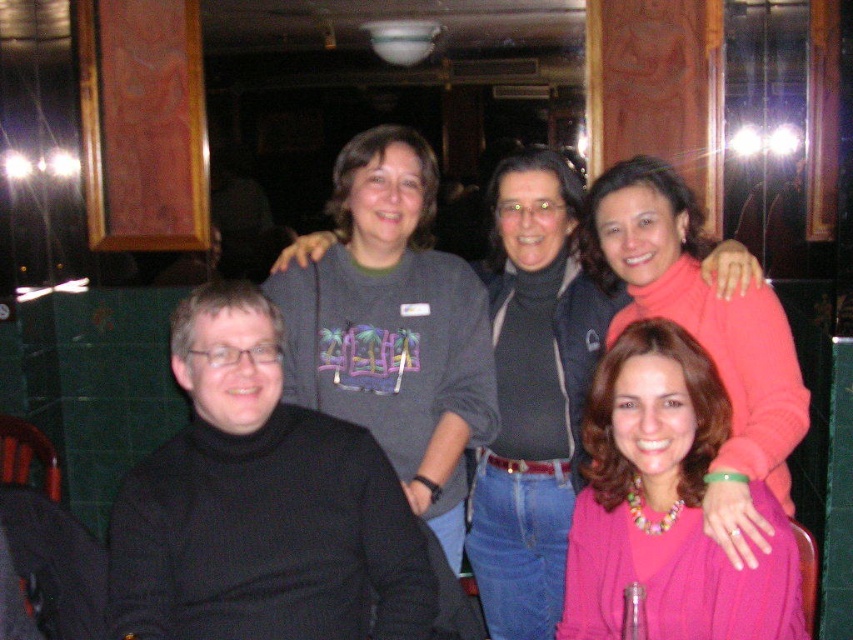
You are taking a photo of the group and want to focus on the person at point (373, 525) and the person at point (688, 202). Which of these two points is closer to the camera?

Point (373, 525) is closer to the camera than point (688, 202).

You are standing in front of the group of five people in the image. You want to place a small gift on the table between the two points labeled point (125,483) and point (642,499). Which point should you place the gift closer to so that it is nearer to the viewer?

You should place the gift closer to point (125,483) because it is nearer to the viewer than point (642,499).

You are standing in the same room as the group in the image. If you want to approach the person wearing the black turtleneck sweater at left, which direction should you move relative to your current position?

The black turtleneck sweater at left is located at point 0.791 on the x axis and 0.308 on the y axis. Since the coordinate system is not specified, you should move towards the left side of the group to reach the person wearing the black turtleneck sweater at left.